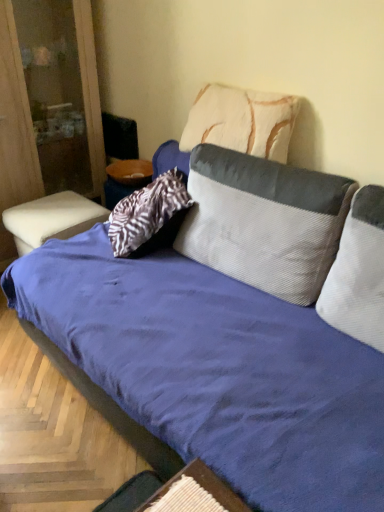
This screenshot has width=384, height=512. Describe the element at coordinates (264, 221) in the screenshot. I see `corduroy gray pillow at center, which appears as the second pillow when ordered from the bottom` at that location.

In order to click on blue corduroy couch at center in this screenshot , I will do coord(216,370).

The image size is (384, 512). Find the location of `white leather ottoman at left`. white leather ottoman at left is located at coordinates (47, 115).

What is the approximate height of wooden textured table at lower center, the second table in the top-to-bottom sequence?

The height of wooden textured table at lower center, the second table in the top-to-bottom sequence, is 1.79 centimeters.

Find the location of a particular element. The height and width of the screenshot is (512, 384). white leather ottoman at lower left, placed as the second table when sorted from front to back is located at coordinates (51, 219).

Identify the location of corduroy gray pillow at center, which ranks as the 2th pillow in top-to-bottom order. The height and width of the screenshot is (512, 384). (264, 221).

From a real-world perspective, which is physically below, corduroy gray pillow at center, which ranks as the 2th pillow in top-to-bottom order, or blue corduroy couch at center?

blue corduroy couch at center is physically lower.

Which is more distant, (247, 240) or (52, 252)?

The point (52, 252) is more distant.

Is corduroy gray pillow at center, which appears as the second pillow when ordered from the bottom, positioned beyond the bounds of blue corduroy couch at center?

No, corduroy gray pillow at center, which appears as the second pillow when ordered from the bottom, is not entirely external to blue corduroy couch at center.

Is white textured pillow at upper center, the 3th pillow ordered from the bottom, placed right next to white leather ottoman at left?

white textured pillow at upper center, the 3th pillow ordered from the bottom, and white leather ottoman at left are not in contact.

Is white textured pillow at upper center, the 3th pillow ordered from the bottom, surrounding white leather ottoman at left?

No.

From a real-world perspective, which object stands above the other?

white textured pillow at upper center, the 3th pillow ordered from the bottom, is physically above.

Measure the distance between white textured pillow at upper center, the 3th pillow ordered from the bottom, and white leather ottoman at left.

A distance of 1.07 meters exists between white textured pillow at upper center, the 3th pillow ordered from the bottom, and white leather ottoman at left.

From a real-world perspective, is wooden textured table at lower center, the 1th table when ordered from front to back, beneath white leather ottoman at left?

Correct, in the physical world, wooden textured table at lower center, the 1th table when ordered from front to back, is lower than white leather ottoman at left.

Locate an element on the screen. This screenshot has height=512, width=384. dresser on the left of wooden textured table at lower center, positioned as the 2th table in left-to-right order is located at coordinates click(x=47, y=115).

Considering the positions of objects wooden textured table at lower center, positioned as the 2th table in left-to-right order, and white leather ottoman at left in the image provided, who is in front, wooden textured table at lower center, positioned as the 2th table in left-to-right order, or white leather ottoman at left?

wooden textured table at lower center, positioned as the 2th table in left-to-right order, is in front.

Is point (212, 136) positioned before point (200, 508)?

No, (212, 136) is behind (200, 508).

Can you see white textured pillow at upper center, the 3th pillow ordered from the bottom, touching wooden textured table at lower center, arranged as the 2th table when viewed from the back?

No, white textured pillow at upper center, the 3th pillow ordered from the bottom, is not with wooden textured table at lower center, arranged as the 2th table when viewed from the back.

Can you confirm if white textured pillow at upper center, positioned as the 1th pillow in top-to-bottom order, is taller than wooden textured table at lower center, the second table in the top-to-bottom sequence?

Yes.

Could you tell me if white textured pillow at upper center, positioned as the 1th pillow in top-to-bottom order, is facing wooden textured table at lower center, the first table when ordered from right to left?

Yes, white textured pillow at upper center, positioned as the 1th pillow in top-to-bottom order, faces towards wooden textured table at lower center, the first table when ordered from right to left.

Does white leather ottoman at lower left, acting as the 1th table starting from the left, turn towards wooden textured table at lower center, the 1th table from the bottom?

No, white leather ottoman at lower left, acting as the 1th table starting from the left, is not oriented towards wooden textured table at lower center, the 1th table from the bottom.

Could wooden textured table at lower center, positioned as the 2th table in left-to-right order, be considered to be inside white leather ottoman at lower left, acting as the 1th table starting from the left?

Definitely not — wooden textured table at lower center, positioned as the 2th table in left-to-right order, is not inside white leather ottoman at lower left, acting as the 1th table starting from the left.

Can you tell me how much white leather ottoman at lower left, which ranks as the 2th table in right-to-left order, and wooden textured table at lower center, the first table when ordered from right to left, differ in facing direction?

4.67 degrees separate the facing orientations of white leather ottoman at lower left, which ranks as the 2th table in right-to-left order, and wooden textured table at lower center, the first table when ordered from right to left.

Image resolution: width=384 pixels, height=512 pixels. I want to click on table lying behind the wooden textured table at lower center, the second table in the top-to-bottom sequence, so click(x=51, y=219).

Is point (28, 228) closer to camera compared to point (373, 366)?

No, it is not.

Is white leather ottoman at lower left, acting as the 1th table starting from the left, oriented towards blue corduroy couch at center?

No, white leather ottoman at lower left, acting as the 1th table starting from the left, is not aimed at blue corduroy couch at center.

Can you confirm if white leather ottoman at lower left, acting as the 1th table starting from the left, is taller than blue corduroy couch at center?

No, white leather ottoman at lower left, acting as the 1th table starting from the left, is not taller than blue corduroy couch at center.

Considering the relative sizes of white leather ottoman at lower left, which ranks as the second table in bottom-to-top order, and blue corduroy couch at center in the image provided, is white leather ottoman at lower left, which ranks as the second table in bottom-to-top order, wider than blue corduroy couch at center?

No.

Which object is closer to the camera, wooden textured table at lower center, the second table in the top-to-bottom sequence, or white corduroy pillow at center, the third pillow when ordered from top to bottom?

wooden textured table at lower center, the second table in the top-to-bottom sequence, is closer to the camera.

Is wooden textured table at lower center, the 1th table from the bottom, smaller than white corduroy pillow at center, which is the first pillow from bottom to top?

Indeed, wooden textured table at lower center, the 1th table from the bottom, has a smaller size compared to white corduroy pillow at center, which is the first pillow from bottom to top.

From the image's perspective, between wooden textured table at lower center, the first table when ordered from right to left, and white corduroy pillow at center, which is the first pillow from bottom to top, which one is located above?

From the image's view, white corduroy pillow at center, which is the first pillow from bottom to top, is above.

From the blue corduroy couch at center, count 2nd pillow to the right and point to it. Please provide its 2D coordinates.

[(264, 221)]

Locate an element on the screen. The height and width of the screenshot is (512, 384). pillow that is the 1st one when counting forward from the white leather ottoman at left is located at coordinates (241, 121).

From the image, which object appears to be nearer to white leather ottoman at left, white leather ottoman at lower left, which ranks as the second table in bottom-to-top order, or white textured pillow at upper center, positioned as the 1th pillow in top-to-bottom order?

Among the two, white leather ottoman at lower left, which ranks as the second table in bottom-to-top order, is located nearer to white leather ottoman at left.

When comparing their distances from blue corduroy couch at center, does corduroy gray pillow at center, which ranks as the 2th pillow in top-to-bottom order, or white leather ottoman at left seem further?

white leather ottoman at left is positioned further to the anchor blue corduroy couch at center.

Considering their positions, is wooden textured table at lower center, positioned as the 2th table in left-to-right order, positioned further to white textured pillow at upper center, the 3th pillow ordered from the bottom, than corduroy gray pillow at center, which ranks as the 2th pillow in top-to-bottom order?

wooden textured table at lower center, positioned as the 2th table in left-to-right order.

Which object lies further to the anchor point white leather ottoman at lower left, the first table positioned from the back, wooden textured table at lower center, the first table when ordered from right to left, or white leather ottoman at left?

wooden textured table at lower center, the first table when ordered from right to left.

Which object lies further to the anchor point corduroy gray pillow at center, which appears as the second pillow when ordered from the bottom, white leather ottoman at left or blue corduroy couch at center?

white leather ottoman at left is further to corduroy gray pillow at center, which appears as the second pillow when ordered from the bottom.

Estimate the real-world distances between objects in this image. Which object is further from white leather ottoman at left, wooden textured table at lower center, arranged as the 2th table when viewed from the back, or white leather ottoman at lower left, the first table positioned from the back?

The object further to white leather ottoman at left is wooden textured table at lower center, arranged as the 2th table when viewed from the back.

Considering their positions, is white leather ottoman at lower left, which ranks as the 2th table in right-to-left order, positioned closer to blue corduroy couch at center than wooden textured table at lower center, the 1th table when ordered from front to back?

wooden textured table at lower center, the 1th table when ordered from front to back.

Estimate the real-world distances between objects in this image. Which object is further from wooden textured table at lower center, the first table when ordered from right to left, blue corduroy couch at center or white textured pillow at upper center, the 3th pillow ordered from the bottom?

white textured pillow at upper center, the 3th pillow ordered from the bottom.

At what (x,y) coordinates should I click in order to perform the action: click on pillow between white leather ottoman at left and corduroy gray pillow at center, which ranks as the 2th pillow in top-to-bottom order, in the horizontal direction. Please return your answer as a coordinate pair (x, y). This screenshot has height=512, width=384. Looking at the image, I should click on (241, 121).

What are the coordinates of `pillow between white leather ottoman at lower left, the first table positioned from the top, and corduroy gray pillow at center, which ranks as the 2th pillow in top-to-bottom order, in the horizontal direction` in the screenshot? It's located at (241, 121).

I want to click on studio couch situated between white leather ottoman at left and white corduroy pillow at center, which is the first pillow from bottom to top, from left to right, so click(x=216, y=370).

The width and height of the screenshot is (384, 512). Find the location of `pillow that lies between corduroy gray pillow at center, which appears as the second pillow when ordered from the bottom, and wooden textured table at lower center, arranged as the 2th table when viewed from the back, from top to bottom`. pillow that lies between corduroy gray pillow at center, which appears as the second pillow when ordered from the bottom, and wooden textured table at lower center, arranged as the 2th table when viewed from the back, from top to bottom is located at coordinates (358, 272).